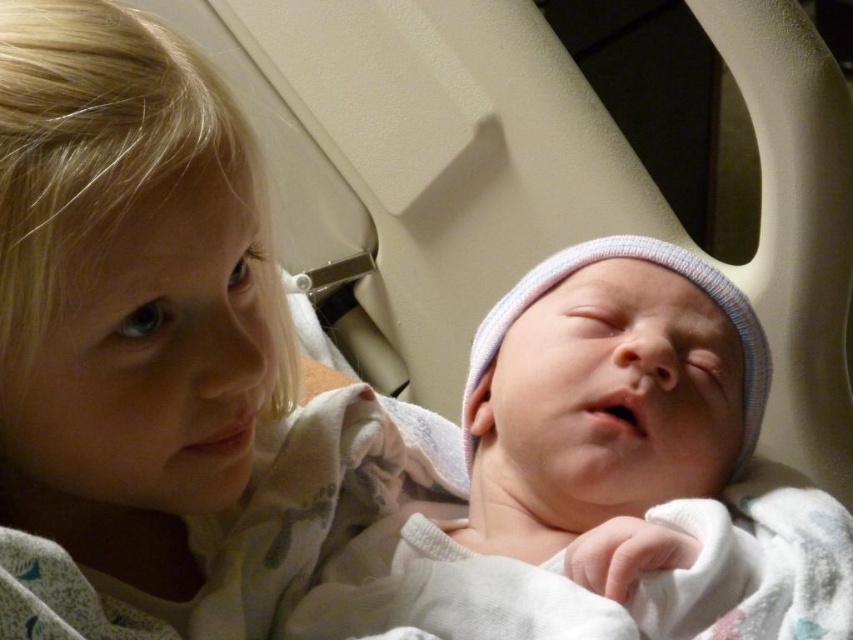
Is point (68, 573) less distant than point (380, 522)?

That is True.

Which is below, smooth white blanket at upper left or white soft hat at center?

Positioned lower is white soft hat at center.

The image size is (853, 640). Describe the element at coordinates (154, 353) in the screenshot. I see `smooth white blanket at upper left` at that location.

The height and width of the screenshot is (640, 853). I want to click on smooth white blanket at upper left, so click(x=154, y=353).